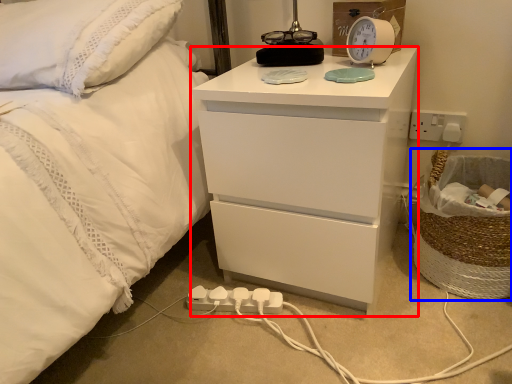
Question: Which object appears closest to the camera in this image, chest of drawers (highlighted by a red box) or laundry basket (highlighted by a blue box)?

Choices:
 (A) chest of drawers
 (B) laundry basket

Answer: (A)